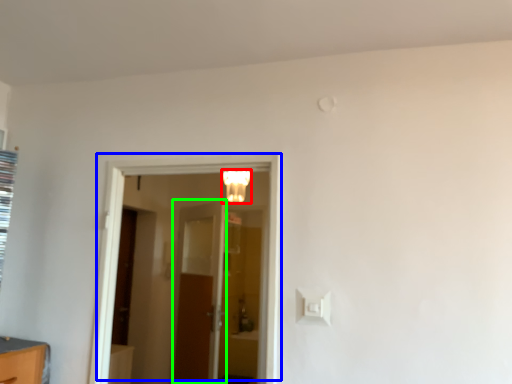
Question: Which object is the farthest from light fixture (highlighted by a red box)? Choose among these: door (highlighted by a blue box) or door (highlighted by a green box).

Choices:
 (A) door
 (B) door

Answer: (A)